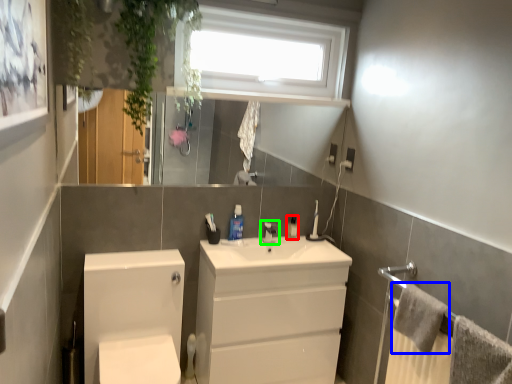
Question: Estimate the real-world distances between objects in this image. Which object is closer to toiletry (highlighted by a red box), bath towel (highlighted by a blue box) or tap (highlighted by a green box)?

Choices:
 (A) bath towel
 (B) tap

Answer: (B)